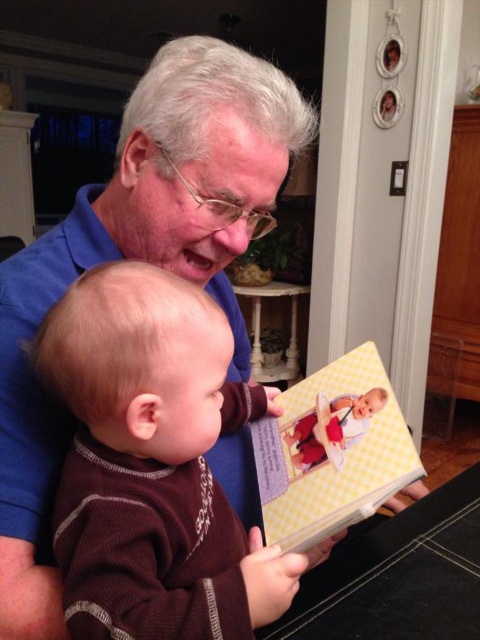
Which is above, blue smooth shirt at upper left or yellow checkered book at center?

blue smooth shirt at upper left is above.

Is blue smooth shirt at upper left below yellow checkered book at center?

No, blue smooth shirt at upper left is not below yellow checkered book at center.

Does point (167, 193) come closer to viewer compared to point (313, 500)?

Yes, point (167, 193) is in front of point (313, 500).

Locate an element on the screen. This screenshot has height=640, width=480. blue smooth shirt at upper left is located at coordinates [x=139, y=259].